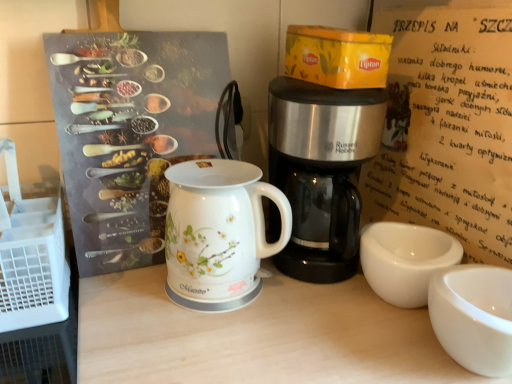
Describe the element at coordinates (218, 233) in the screenshot. I see `white glossy electric kettle at center` at that location.

What do you see at coordinates (447, 129) in the screenshot?
I see `white paper at upper right` at bounding box center [447, 129].

Identify the location of stainless steel coffee maker at center. (321, 171).

From the image's perspective, who appears lower, white plastic crate at left or white glossy electric kettle at center?

From the image's view, white glossy electric kettle at center is below.

Does white plastic crate at left contain white glossy electric kettle at center?

That's incorrect, white glossy electric kettle at center is not inside white plastic crate at left.

Are white plastic crate at left and white glossy electric kettle at center beside each other?

They are not placed beside each other.

Between white plastic crate at left and white glossy cup at lower right, which one has smaller size?

white glossy cup at lower right.

Identify the location of coffee cup below the white plastic crate at left (from the image's perspective). Image resolution: width=512 pixels, height=384 pixels. (474, 316).

From the image's perspective, between white plastic crate at left and white glossy cup at lower right, who is located below?

From the image's view, white glossy cup at lower right is below.

Would you say white plastic crate at left is inside or outside white glossy cup at lower right?

white plastic crate at left lies outside white glossy cup at lower right.

Consider the image. From a real-world perspective, who is located higher, white paper at upper right or white glossy cup at lower right?

white paper at upper right.

Can you confirm if white paper at upper right is taller than white glossy cup at lower right?

Correct, white paper at upper right is much taller as white glossy cup at lower right.

Which of these two, white paper at upper right or white glossy cup at lower right, is thinner?

Thinner between the two is white paper at upper right.

Can you tell me how much white paper at upper right and white glossy cup at lower right differ in facing direction?

89.3 degrees separate the facing orientations of white paper at upper right and white glossy cup at lower right.

From a real-world perspective, is stainless steel coffee maker at center over white glossy cup at lower right?

Yes, from a real-world perspective, stainless steel coffee maker at center is on top of white glossy cup at lower right.

Can you confirm if stainless steel coffee maker at center is shorter than white glossy cup at lower right?

Incorrect, the height of stainless steel coffee maker at center does not fall short of that of white glossy cup at lower right.

From the image's perspective, is stainless steel coffee maker at center located beneath white glossy cup at lower right?

No, from the image's perspective, stainless steel coffee maker at center is not beneath white glossy cup at lower right.

Considering the relative positions of stainless steel coffee maker at center and white glossy cup at lower right in the image provided, is stainless steel coffee maker at center to the right of white glossy cup at lower right from the viewer's perspective?

Incorrect, stainless steel coffee maker at center is not on the right side of white glossy cup at lower right.

Is white glossy electric kettle at center situated inside white paper at upper right or outside?

white glossy electric kettle at center is outside white paper at upper right.

Which of these two, white glossy electric kettle at center or white paper at upper right, stands taller?

white paper at upper right.

Considering the relative sizes of white glossy electric kettle at center and white paper at upper right in the image provided, is white glossy electric kettle at center thinner than white paper at upper right?

No.

Is white plastic crate at left far away from white paper at upper right?

They are positioned close to each other.

Which object is further away from the camera taking this photo, white plastic crate at left or white paper at upper right?

white plastic crate at left is further from the camera.

Considering the sizes of white plastic crate at left and white paper at upper right in the image, is white plastic crate at left bigger or smaller than white paper at upper right?

Considering their sizes, white plastic crate at left takes up less space than white paper at upper right.

From the image's perspective, is white plastic crate at left above or below white paper at upper right?

Clearly, from the image's perspective, white plastic crate at left is below white paper at upper right.

Considering the sizes of objects white glossy cup at lower right and stainless steel coffee maker at center in the image provided, who is bigger, white glossy cup at lower right or stainless steel coffee maker at center?

Bigger between the two is stainless steel coffee maker at center.

Is white glossy cup at lower right not within stainless steel coffee maker at center?

That's correct, white glossy cup at lower right is outside of stainless steel coffee maker at center.

From the image's perspective, which is above, white glossy cup at lower right or stainless steel coffee maker at center?

stainless steel coffee maker at center, from the image's perspective.

Is point (468, 280) positioned in front of point (319, 89)?

Yes, it is in front of point (319, 89).

Where is `jug located underneath the white plastic crate at left (from a real-world perspective)`? This screenshot has width=512, height=384. jug located underneath the white plastic crate at left (from a real-world perspective) is located at coordinates (218, 233).

This screenshot has height=384, width=512. What are the coordinates of `crate above the white glossy cup at lower right (from the image's perspective)` in the screenshot? It's located at (31, 256).

Looking at the image, which one is located closer to white plastic crate at left, stainless steel coffee maker at center or white glossy electric kettle at center?

Among the two, white glossy electric kettle at center is located nearer to white plastic crate at left.

Estimate the real-world distances between objects in this image. Which object is further from stainless steel coffee maker at center, white glossy electric kettle at center or white paper at upper right?

white paper at upper right.

Based on their spatial positions, is white paper at upper right or white plastic crate at left closer to stainless steel coffee maker at center?

The object closer to stainless steel coffee maker at center is white paper at upper right.

When comparing their distances from white glossy electric kettle at center, does stainless steel coffee maker at center or white plastic crate at left seem further?

white plastic crate at left.

Looking at the image, which one is located further to stainless steel coffee maker at center, white plastic crate at left or white paper at upper right?

white plastic crate at left is positioned further to the anchor stainless steel coffee maker at center.

Considering their positions, is stainless steel coffee maker at center positioned further to white glossy electric kettle at center than white glossy cup at lower right?

Based on the image, white glossy cup at lower right appears to be further to white glossy electric kettle at center.

Considering their positions, is white glossy electric kettle at center positioned closer to white plastic crate at left than white paper at upper right?

The object closer to white plastic crate at left is white glossy electric kettle at center.

From the image, which object appears to be nearer to white plastic crate at left, white glossy electric kettle at center or white glossy cup at lower right?

Based on the image, white glossy electric kettle at center appears to be nearer to white plastic crate at left.

Find the location of a particular element. The image size is (512, 384). coffee maker between white plastic crate at left and white paper at upper right in the horizontal direction is located at coordinates (321, 171).

Find the location of `coffee maker between white glossy electric kettle at center and white glossy cup at lower right from left to right`. coffee maker between white glossy electric kettle at center and white glossy cup at lower right from left to right is located at coordinates (321, 171).

What are the coordinates of `coffee maker between white glossy electric kettle at center and white paper at upper right in the horizontal direction` in the screenshot? It's located at (321, 171).

Locate an element on the screen. jug between white plastic crate at left and white glossy cup at lower right from left to right is located at coordinates (218, 233).